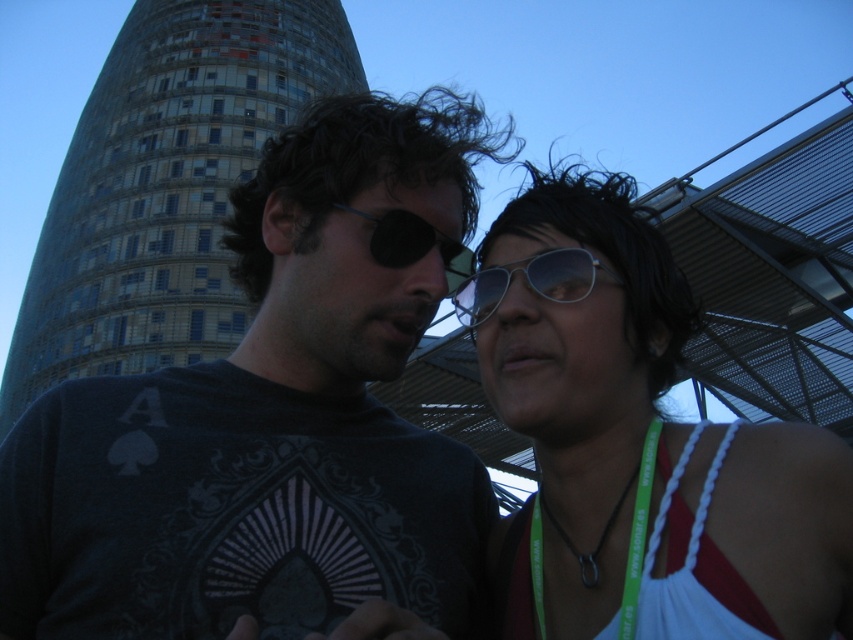
Question: Which object is the closest to the dark gray t-shirt at center?

Choices:
 (A) silver metallic aviator sunglasses at center
 (B) white fabric top at upper right

Answer: (B)

Question: Which point appears closest to the camera in this image?

Choices:
 (A) (496, 284)
 (B) (563, 611)
 (C) (169, 600)

Answer: (C)

Question: Does white fabric top at upper right lie in front of black plastic eye patch at center?

Choices:
 (A) no
 (B) yes

Answer: (B)

Question: Does dark gray t-shirt at center appear on the right side of black plastic eye patch at center?

Choices:
 (A) no
 (B) yes

Answer: (A)

Question: Which of the following is the closest to the observer?

Choices:
 (A) dark gray t-shirt at center
 (B) white fabric top at upper right

Answer: (A)

Question: Does dark gray t-shirt at center appear on the right side of silver metallic aviator sunglasses at center?

Choices:
 (A) no
 (B) yes

Answer: (A)